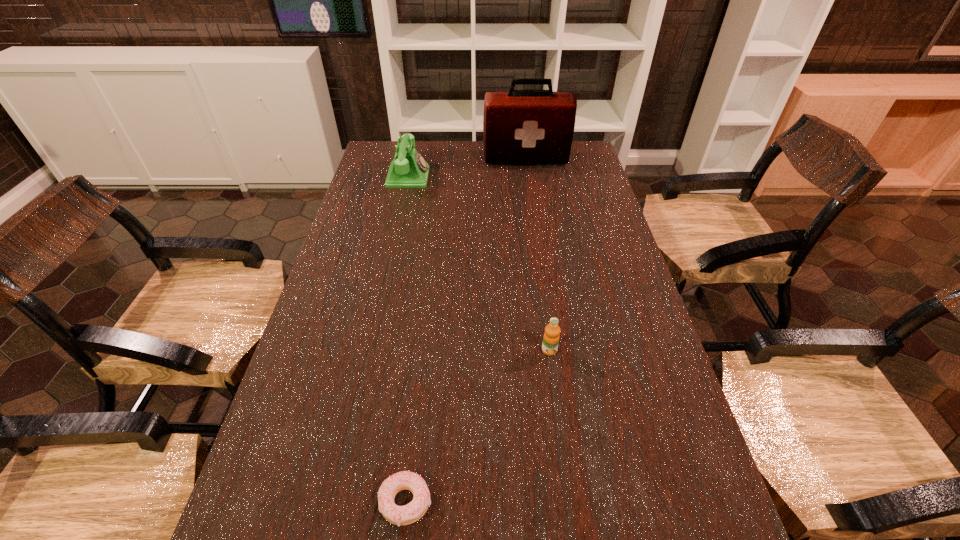
This screenshot has width=960, height=540. What are the coordinates of `vacant region at the far left corner of the desktop` in the screenshot? It's located at (393, 149).

The width and height of the screenshot is (960, 540). Identify the location of vacant area at the far right corner of the desktop. (582, 159).

You are a GUI agent. You are given a task and a screenshot of the screen. Output one action in this format:
    pyautogui.click(x=<x>, y=<y>)
    Task: Click on the free space between the first aid kit and the orange juice
    
    Given the screenshot: What is the action you would take?
    pyautogui.click(x=538, y=255)

I want to click on free space between the second shortest object and the first aid kit, so [x=538, y=255].

Find the location of `free area in between the third object from right to left and the tallest object`. free area in between the third object from right to left and the tallest object is located at coordinates (466, 331).

Locate an element on the screen. free space between the telephone and the second nearest object is located at coordinates (479, 264).

Find the location of `free area in between the tallest object and the telephone`. free area in between the tallest object and the telephone is located at coordinates 468,168.

The image size is (960, 540). What are the coordinates of `empty space that is in between the leftmost object and the nearest object` in the screenshot? It's located at (407, 340).

The image size is (960, 540). In order to click on vacant space that's between the leftmost object and the third object from right to left in this screenshot , I will do `click(407, 340)`.

Locate an element on the screen. The image size is (960, 540). vacant space that is in between the nearest object and the telephone is located at coordinates (407, 340).